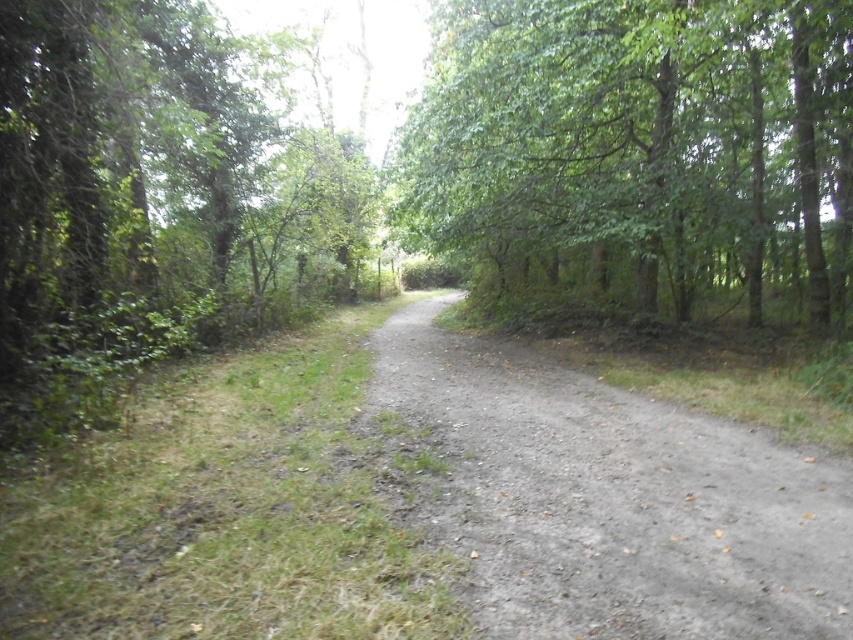
Question: Which point is closer to the camera?

Choices:
 (A) green leafy tree at upper right
 (B) dirt/gravel path at center

Answer: (B)

Question: Considering the relative positions of green leafy tree at left and dirt/gravel path at center in the image provided, where is green leafy tree at left located with respect to dirt/gravel path at center?

Choices:
 (A) right
 (B) left

Answer: (B)

Question: Considering the relative positions of green leafy tree at upper right and dirt/gravel path at center in the image provided, where is green leafy tree at upper right located with respect to dirt/gravel path at center?

Choices:
 (A) left
 (B) right

Answer: (B)

Question: Can you confirm if green leafy tree at left is positioned above dirt/gravel path at center?

Choices:
 (A) no
 (B) yes

Answer: (B)

Question: Estimate the real-world distances between objects in this image. Which object is farther from the green leafy tree at upper right?

Choices:
 (A) green leafy tree at left
 (B) dirt/gravel path at center

Answer: (A)

Question: Which of the following is the closest to the observer?

Choices:
 (A) (735, 282)
 (B) (596, 620)
 (C) (344, 280)

Answer: (B)